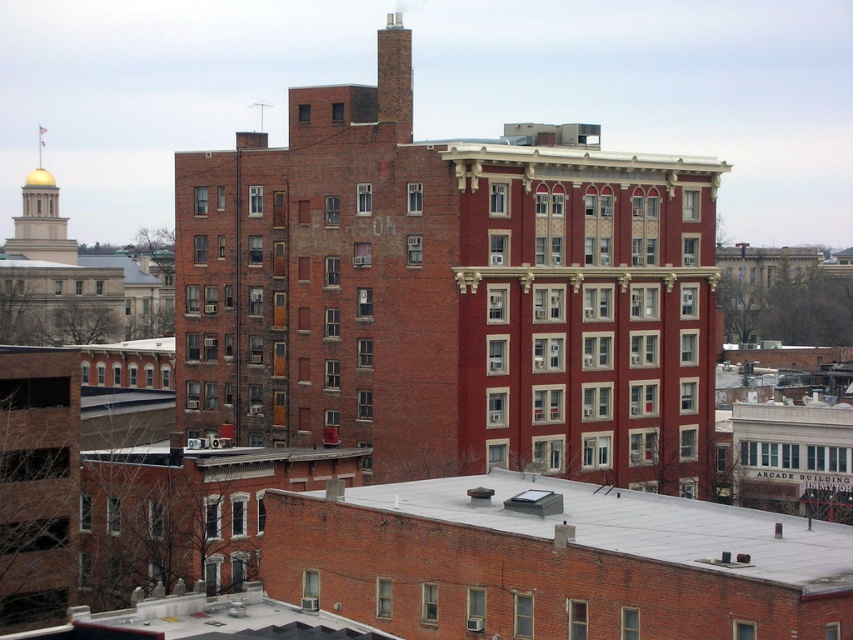
You are an architect examining the building and notice two brick chimneys. The first is labeled as the brick chimney at center, and the second is the brick chimney at upper center. Based on their positions, which chimney would cast a shorter shadow during midday when the sun is directly overhead?

The brick chimney at center has a lesser height compared to the brick chimney at upper center. Since shorter objects cast shorter shadows, the brick chimney at center would cast a shorter shadow.

You are a delivery drone that needs to fly between the brick chimney at center and the brick chimney at upper center. The minimum safe distance between your drone and any object must be at least 40 feet. Is this flight path possible?

The brick chimney at center and brick chimney at upper center are 41.36 feet apart. Since the minimum safe distance required is 40 feet, the drone can safely fly between them as the distance between the chimneys exceeds the required safety margin.

You are standing at the entrance of the multi story brick building and looking towards the center of the building. Where exactly is the brick chimney at center located in terms of coordinates?

The brick chimney at center is located at coordinates point [450,298].